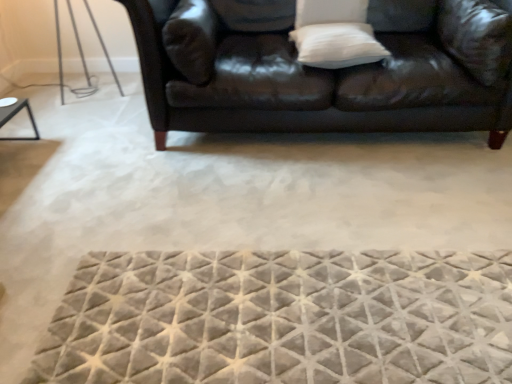
Question: Which direction should I rotate to look at white soft pillow at upper center, which is the 3th pillow in right-to-left order, — up or down?

Choices:
 (A) up
 (B) down

Answer: (A)

Question: Does white soft pillow at upper right, the first pillow in the right-to-left sequence, have a larger size compared to leather couch at upper center?

Choices:
 (A) no
 (B) yes

Answer: (A)

Question: From a real-world perspective, is white soft pillow at upper right, marked as the 3th pillow in a left-to-right arrangement, beneath leather couch at upper center?

Choices:
 (A) yes
 (B) no

Answer: (B)

Question: Is the position of white soft pillow at upper right, the first pillow in the right-to-left sequence, less distant than that of leather couch at upper center?

Choices:
 (A) no
 (B) yes

Answer: (A)

Question: Can you confirm if white soft pillow at upper right, marked as the 3th pillow in a left-to-right arrangement, is wider than leather couch at upper center?

Choices:
 (A) yes
 (B) no

Answer: (B)

Question: Is white soft pillow at upper right, the first pillow in the right-to-left sequence, smaller than leather couch at upper center?

Choices:
 (A) no
 (B) yes

Answer: (B)

Question: From the image's perspective, would you say white soft pillow at upper right, the first pillow in the right-to-left sequence, is shown under leather couch at upper center?

Choices:
 (A) yes
 (B) no

Answer: (A)

Question: Is textured gray mat at center positioned before white soft pillow at upper center, arranged as the first pillow when viewed from the left?

Choices:
 (A) no
 (B) yes

Answer: (B)

Question: Does textured gray mat at center touch white soft pillow at upper center, which is the 3th pillow in right-to-left order?

Choices:
 (A) no
 (B) yes

Answer: (A)

Question: Considering the relative sizes of textured gray mat at center and white soft pillow at upper center, which is the 3th pillow in right-to-left order, in the image provided, is textured gray mat at center wider than white soft pillow at upper center, which is the 3th pillow in right-to-left order,?

Choices:
 (A) no
 (B) yes

Answer: (B)

Question: Can you confirm if textured gray mat at center is positioned to the right of white soft pillow at upper center, arranged as the first pillow when viewed from the left?

Choices:
 (A) yes
 (B) no

Answer: (B)

Question: Considering the relative sizes of textured gray mat at center and white soft pillow at upper center, which is the 3th pillow in right-to-left order, in the image provided, is textured gray mat at center shorter than white soft pillow at upper center, which is the 3th pillow in right-to-left order,?

Choices:
 (A) no
 (B) yes

Answer: (B)

Question: Can you confirm if textured gray mat at center is taller than white soft pillow at upper center, which is the 3th pillow in right-to-left order?

Choices:
 (A) yes
 (B) no

Answer: (B)

Question: Considering the relative sizes of textured gray mat at center and white soft pillow at upper right, the first pillow in the right-to-left sequence, in the image provided, is textured gray mat at center bigger than white soft pillow at upper right, the first pillow in the right-to-left sequence,?

Choices:
 (A) no
 (B) yes

Answer: (A)